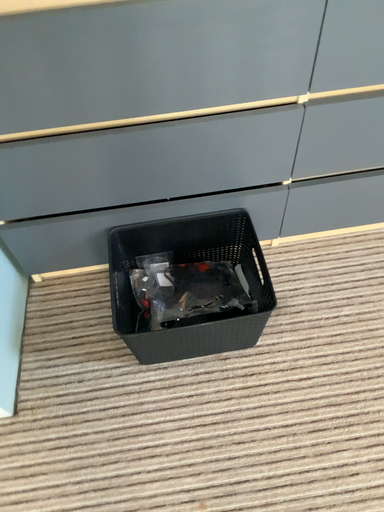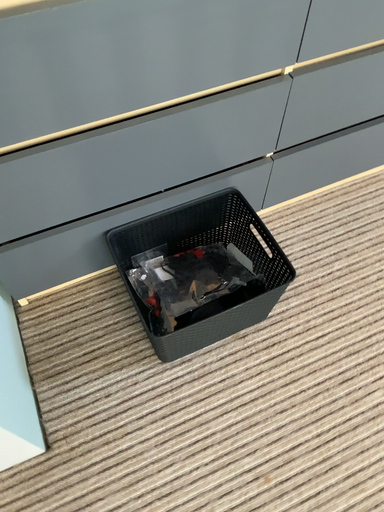
Question: Which way did the camera rotate in the video?

Choices:
 (A) rotated right
 (B) rotated left

Answer: (A)